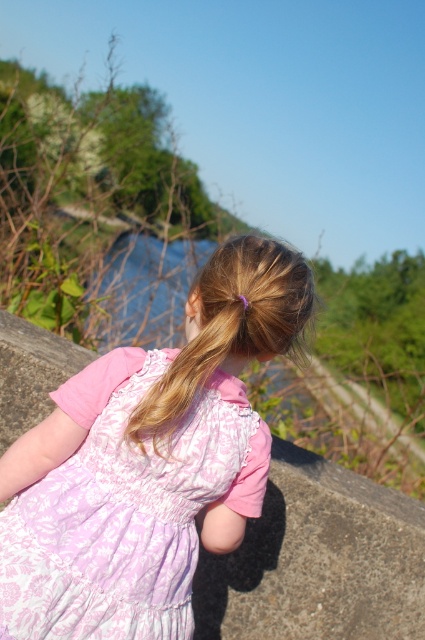
You are a photographer trying to capture the girl in the scene. The pink lace dress at center and the blonde silky hair at center are important elements for your shot. Given that your camera has a focus range of 3 inches, will you be able to focus on both elements simultaneously?

The pink lace dress at center and the blonde silky hair at center are 3.52 inches apart from each other. Since the camera has a focus range of 3 inches, the distance between them exceeds the focus range. Therefore, you cannot focus on both elements simultaneously.

You are a photographer trying to capture the girl in the scene. You notice the pink lace dress at center and the blonde silky hair at center. Which object is positioned lower in the image?

The pink lace dress at center is positioned lower than the blonde silky hair at center.

You are a photographer trying to capture the girl in the scene. Since the pink lace dress at center and the blonde silky hair at center are both at the center, which one should you focus on to ensure the subject is clearly visible?

The pink lace dress at center is in front of the blonde silky hair at center, so focusing on the pink lace dress at center will ensure the subject is clearly visible.